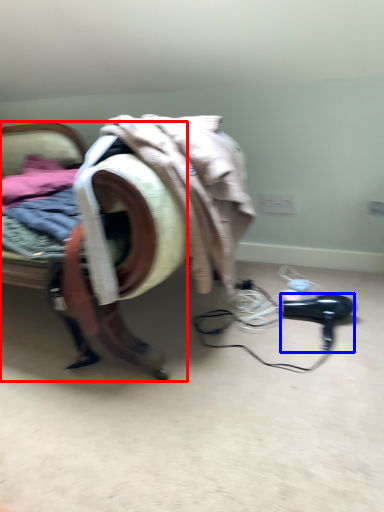
Question: Which object appears closest to the camera in this image, furniture (highlighted by a red box) or hair drier (highlighted by a blue box)?

Choices:
 (A) furniture
 (B) hair drier

Answer: (A)